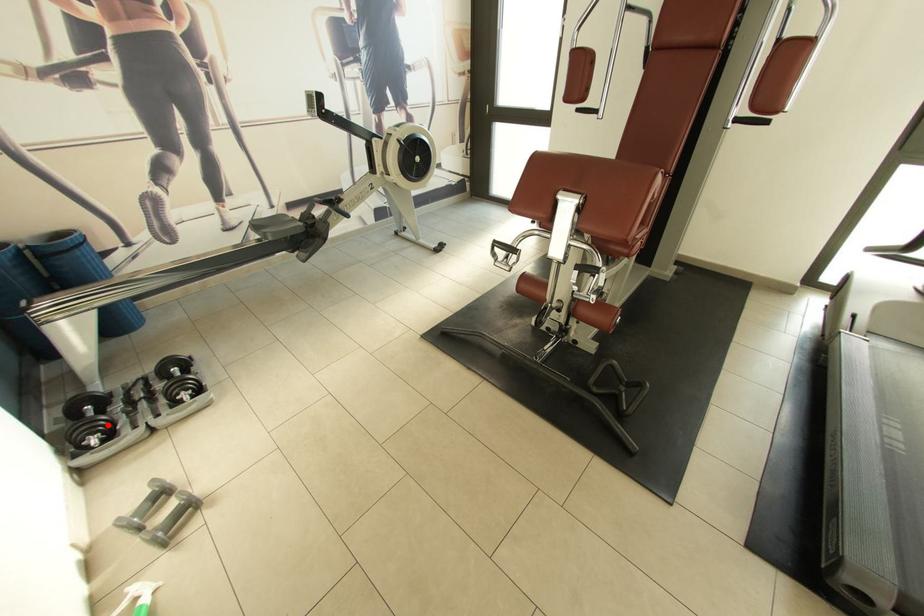
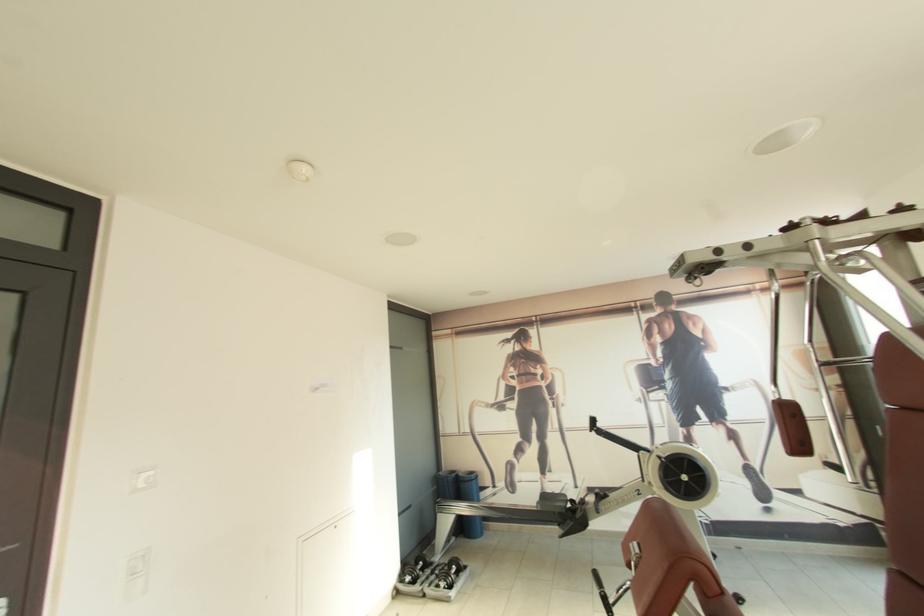
Locate, in the second image, the point that corresponds to the highlighted location in the first image.

(419, 575)